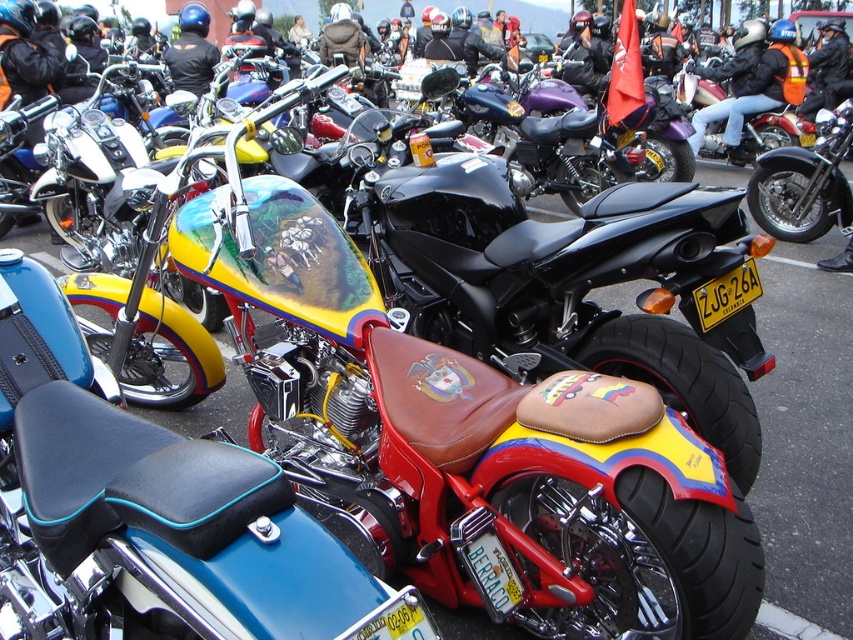
You are standing at the entrance of the motorcycle event. You see two points marked in the image, point 1 at coordinates point [97,429] and point 2 at coordinates point [758,93]. Which point is closer to you?

Point [97,429] is in front of point [758,93], so it is closer to you.

You are a photographer standing at the event and want to take a closeup photo of the shiny chrome engine at center. If your camera has a minimum focusing distance of 3 feet, will you be able to take the photo without moving closer?

The shiny chrome engine at center and camera are 3.40 feet apart. Since the minimum focusing distance is 3 feet, the photographer can take the closeup photo without moving closer because the distance is sufficient.

You are a photographer standing at the edge of the motorcycle gathering. You want to take a photo that includes both the shiny chrome engine at center and the matte black motorcycle at center. Given that your camera has a maximum focus range of 6 meters, will you be able to capture both objects in focus without moving your position?

The shiny chrome engine at center and the matte black motorcycle at center are 6.97 meters apart from each other. Since the distance between them exceeds the camera maximum focus range of 6 meters, you will not be able to capture both in focus without moving your position.